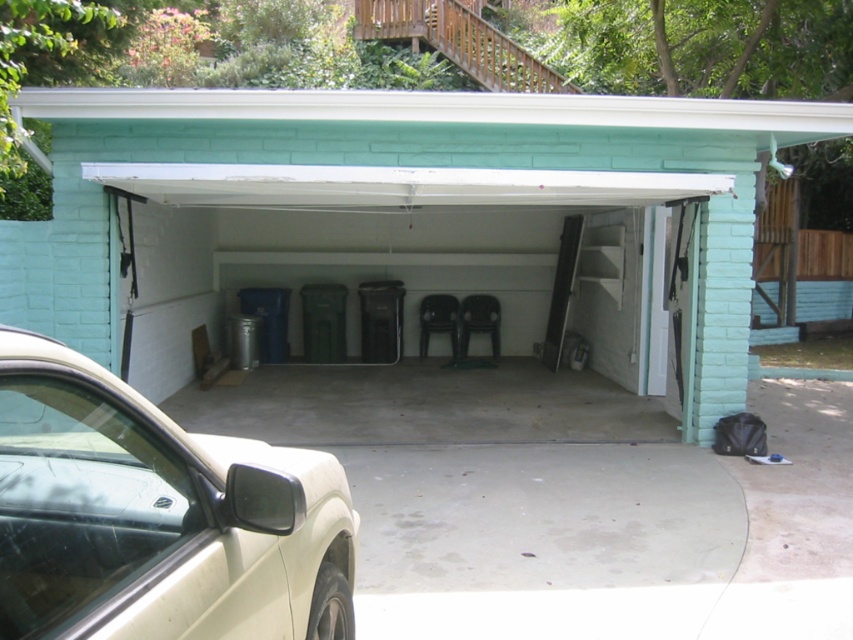
Does white plastic chairs at center appear over beige matte car at lower left?

Correct, white plastic chairs at center is located above beige matte car at lower left.

Is white plastic chairs at center to the left of beige matte car at lower left from the viewer's perspective?

In fact, white plastic chairs at center is to the right of beige matte car at lower left.

Who is more distant from viewer, (173, 262) or (113, 557)?

Positioned behind is point (173, 262).

This screenshot has width=853, height=640. Find the location of `white plastic chairs at center`. white plastic chairs at center is located at coordinates (407, 221).